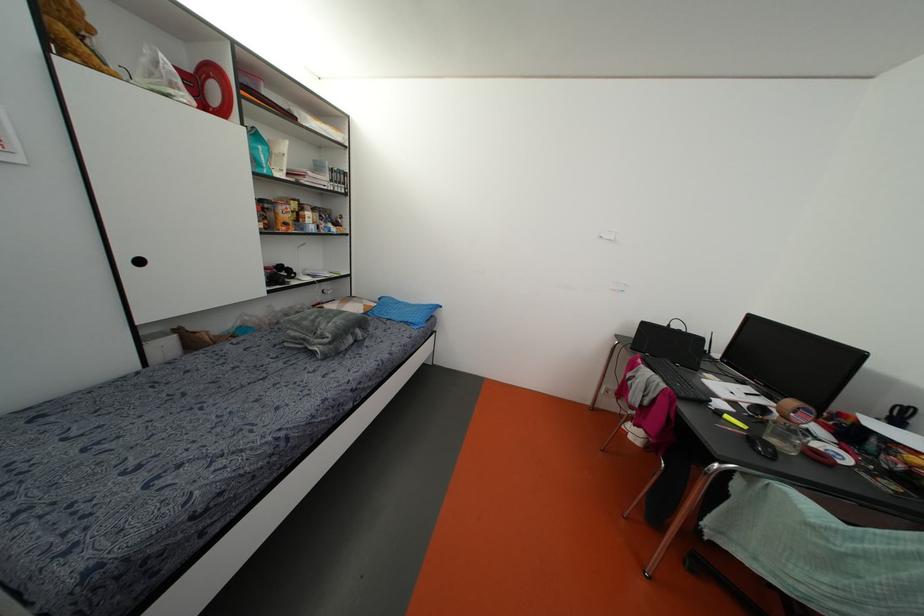
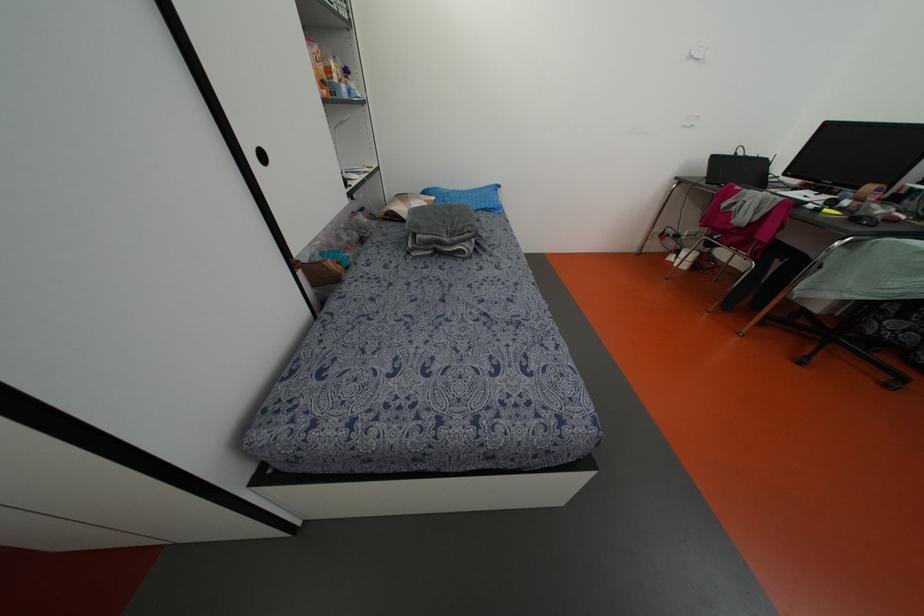
Locate, in the second image, the point that corresponds to the point at 140,262 in the first image.

(262, 156)